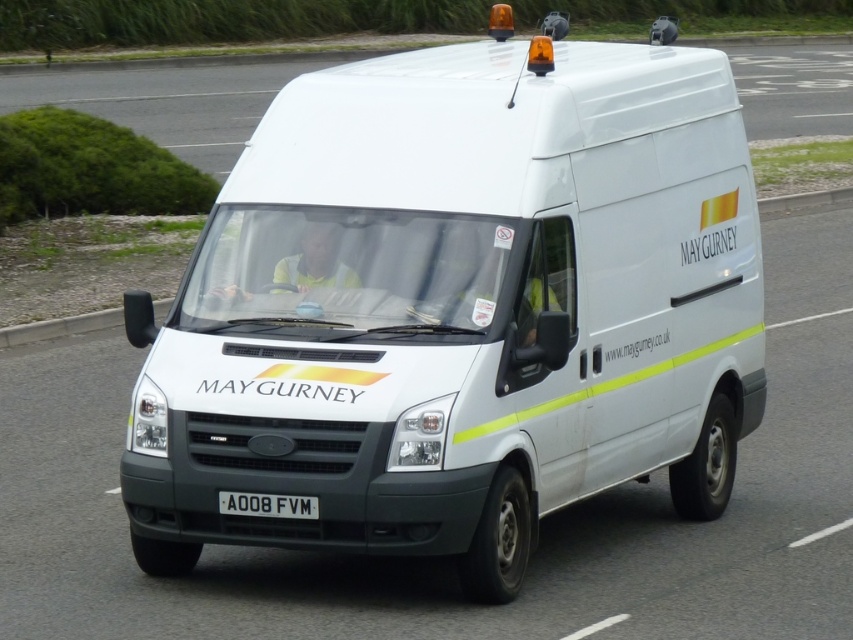
Can you confirm if white matte van at center is shorter than white glossy van at center?

Correct, white matte van at center is not as tall as white glossy van at center.

Is point (343, 112) farther from camera compared to point (758, 124)?

No, (343, 112) is in front of (758, 124).

Locate an element on the screen. The height and width of the screenshot is (640, 853). white matte van at center is located at coordinates tap(459, 307).

Is white glossy van at center positioned in front of black plastic license plate at center?

No, it is not.

Describe the element at coordinates (167, 100) in the screenshot. I see `white glossy van at center` at that location.

Identify the location of white glossy van at center. (167, 100).

Which is below, white matte van at center or black plastic license plate at center?

black plastic license plate at center

Between white matte van at center and black plastic license plate at center, which one has less height?

With less height is black plastic license plate at center.

You are a GUI agent. You are given a task and a screenshot of the screen. Output one action in this format:
    pyautogui.click(x=<x>, y=<y>)
    Task: Click on the white matte van at center
    The width and height of the screenshot is (853, 640).
    Given the screenshot: What is the action you would take?
    pyautogui.click(x=459, y=307)